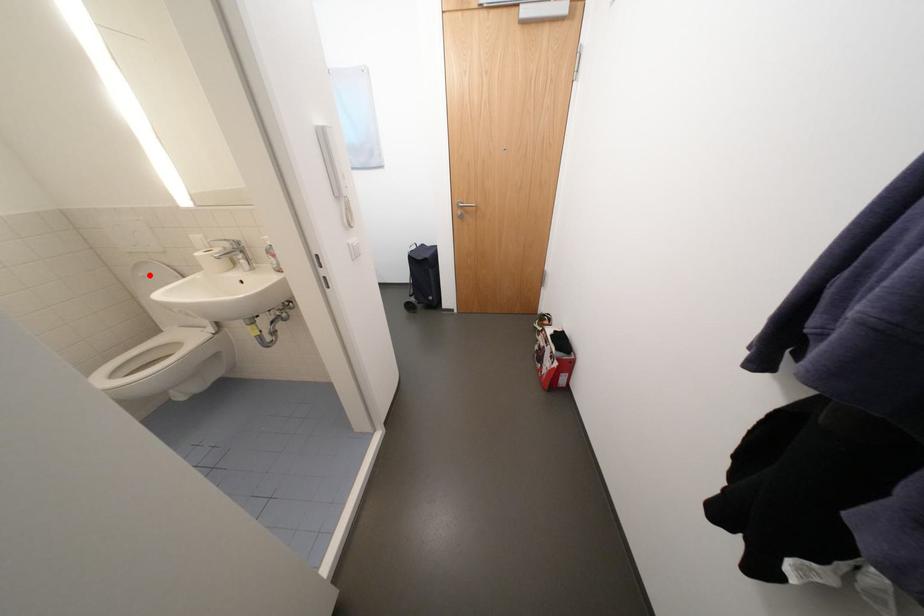
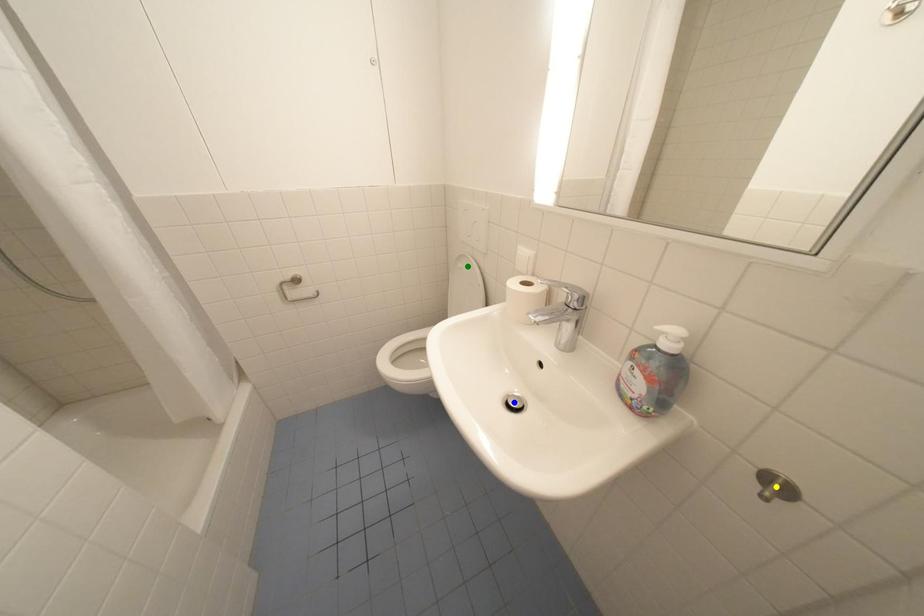
Question: I am providing you with two images of the same scene from different viewpoints. A red point is marked on the first image. You are given multiple points on the second image. Can you choose the point in image 2 that corresponds to the point in image 1?

Choices:
 (A) yellow point
 (B) green point
 (C) blue point

Answer: (B)